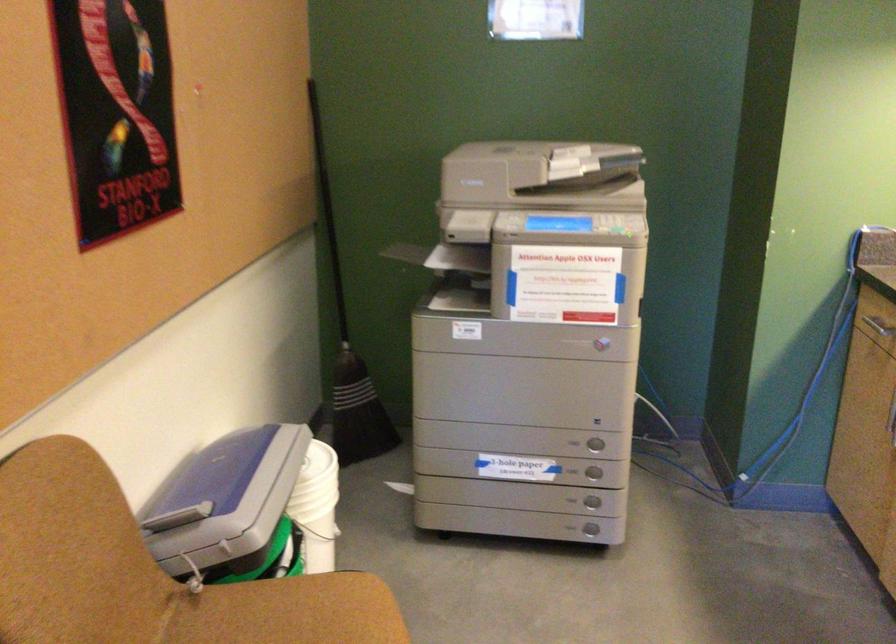
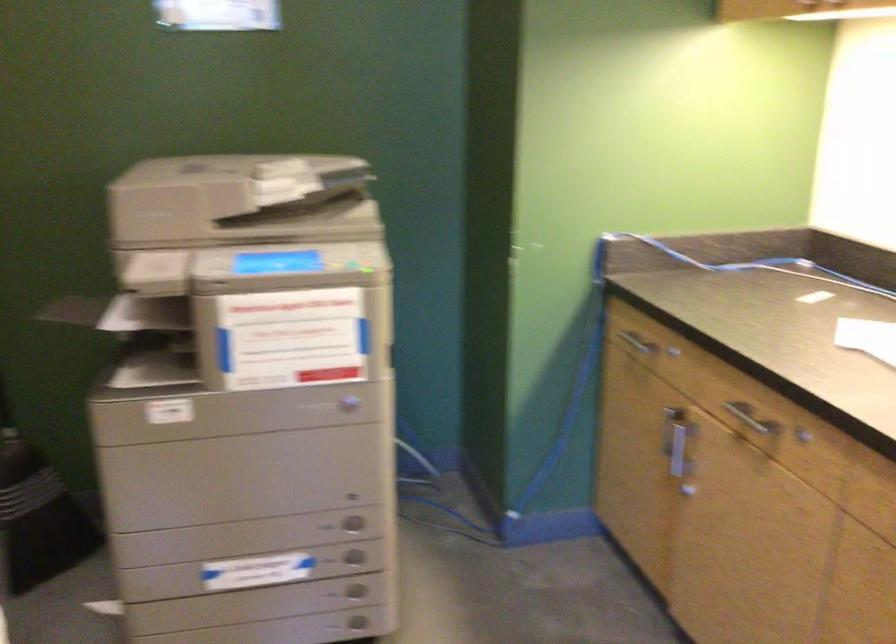
Question: How did the camera likely rotate?

Choices:
 (A) Left
 (B) Right
 (C) Up
 (D) Down

Answer: (B)